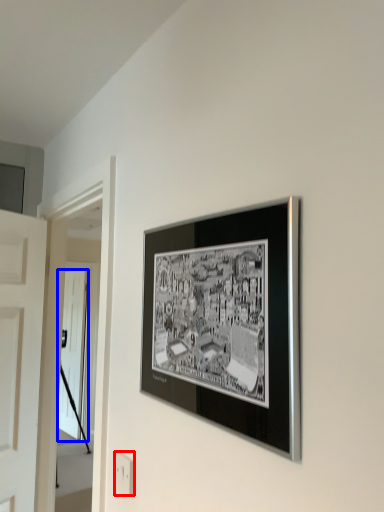
Question: Which of the following is the farthest to the observer, electric outlet (highlighted by a red box) or door (highlighted by a blue box)?

Choices:
 (A) electric outlet
 (B) door

Answer: (B)